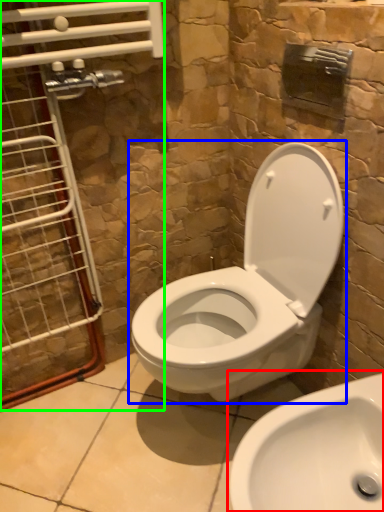
Question: Based on their relative distances, which object is nearer to sink (highlighted by a red box)? Choose from toilet (highlighted by a blue box) and glass door (highlighted by a green box).

Choices:
 (A) toilet
 (B) glass door

Answer: (A)